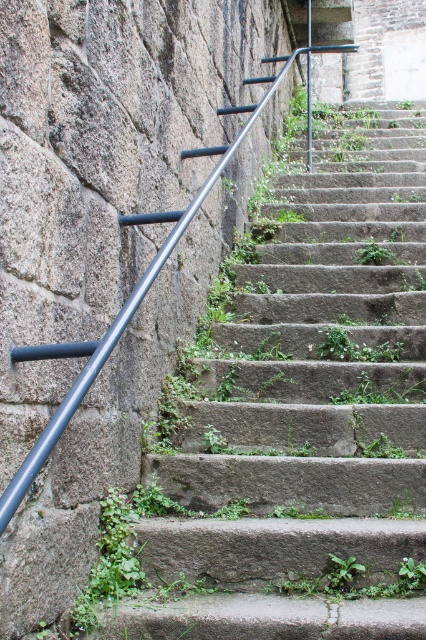
Question: Which of the following is the closest to the observer?

Choices:
 (A) green leafy plant at center
 (B) smooth concrete stairs at center
 (C) green leafy weed at center

Answer: (B)

Question: Based on their relative distances, which object is nearer to the green leafy plant at center?

Choices:
 (A) smooth concrete stairs at center
 (B) green leafy weed at center

Answer: (A)

Question: Can you confirm if smooth concrete stairs at center is bigger than green leafy plant at center?

Choices:
 (A) yes
 (B) no

Answer: (A)

Question: Which point is closer to the camera taking this photo?

Choices:
 (A) (373, 257)
 (B) (379, 136)

Answer: (A)

Question: Does smooth concrete stairs at center have a lesser width compared to green leafy weed at center?

Choices:
 (A) no
 (B) yes

Answer: (A)

Question: Can you confirm if smooth concrete stairs at center is positioned above green leafy weed at center?

Choices:
 (A) no
 (B) yes

Answer: (B)